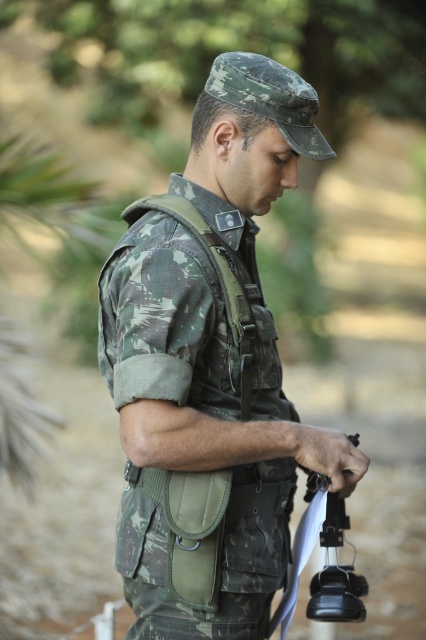
Question: Among these points, which one is farthest from the camera?

Choices:
 (A) (285, 518)
 (B) (345, 577)

Answer: (A)

Question: Can you confirm if camouflage fabric uniform at center is smaller than black plastic gun at center?

Choices:
 (A) yes
 (B) no

Answer: (B)

Question: Is camouflage fabric uniform at center positioned in front of black plastic gun at center?

Choices:
 (A) yes
 (B) no

Answer: (A)

Question: Does camouflage fabric uniform at center appear under black plastic gun at center?

Choices:
 (A) no
 (B) yes

Answer: (A)